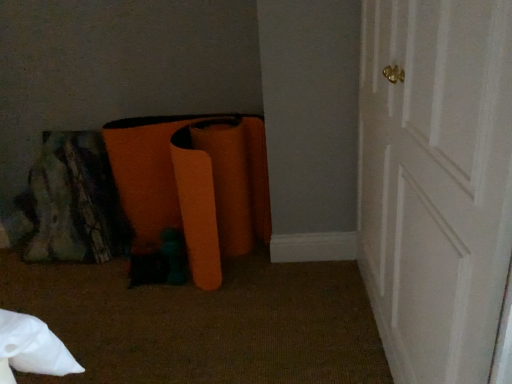
Question: Considering the relative sizes of orange fabric bean bag at lower left and white wood door at right in the image provided, is orange fabric bean bag at lower left smaller than white wood door at right?

Choices:
 (A) yes
 (B) no

Answer: (A)

Question: Can you confirm if orange fabric bean bag at lower left is bigger than white wood door at right?

Choices:
 (A) yes
 (B) no

Answer: (B)

Question: Does orange fabric bean bag at lower left have a greater height compared to white wood door at right?

Choices:
 (A) yes
 (B) no

Answer: (B)

Question: Is orange fabric bean bag at lower left positioned with its back to white wood door at right?

Choices:
 (A) yes
 (B) no

Answer: (B)

Question: Are orange fabric bean bag at lower left and white wood door at right located far from each other?

Choices:
 (A) yes
 (B) no

Answer: (B)

Question: Is orange fabric bean bag at lower left positioned before white wood door at right?

Choices:
 (A) yes
 (B) no

Answer: (B)

Question: From the image's perspective, is white wood door at right above orange fabric bean bag at lower left?

Choices:
 (A) yes
 (B) no

Answer: (B)

Question: From the image's perspective, is white wood door at right located beneath orange fabric bean bag at lower left?

Choices:
 (A) yes
 (B) no

Answer: (A)

Question: Is orange fabric bean bag at lower left at the back of white wood door at right?

Choices:
 (A) no
 (B) yes

Answer: (A)

Question: Considering the relative sizes of white wood door at right and orange fabric bean bag at lower left in the image provided, is white wood door at right shorter than orange fabric bean bag at lower left?

Choices:
 (A) yes
 (B) no

Answer: (B)

Question: Can you confirm if white wood door at right is bigger than orange fabric bean bag at lower left?

Choices:
 (A) no
 (B) yes

Answer: (B)

Question: From a real-world perspective, is white wood door at right on orange fabric bean bag at lower left?

Choices:
 (A) no
 (B) yes

Answer: (B)

Question: Considering the positions of white wood door at right and orange fabric bean bag at lower left in the image, is white wood door at right bigger or smaller than orange fabric bean bag at lower left?

Choices:
 (A) big
 (B) small

Answer: (A)